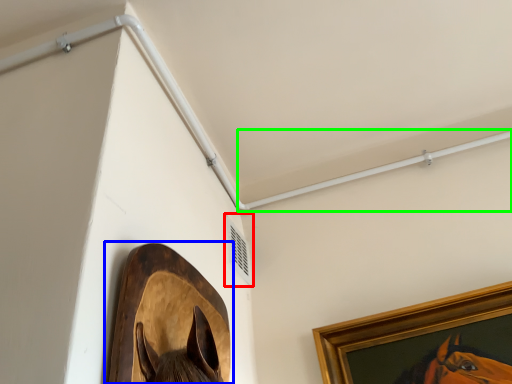
Question: Which object is the farthest from air conditioning (highlighted by a red box)? Choose among these: picture frame (highlighted by a blue box) or beam (highlighted by a green box).

Choices:
 (A) picture frame
 (B) beam

Answer: (A)